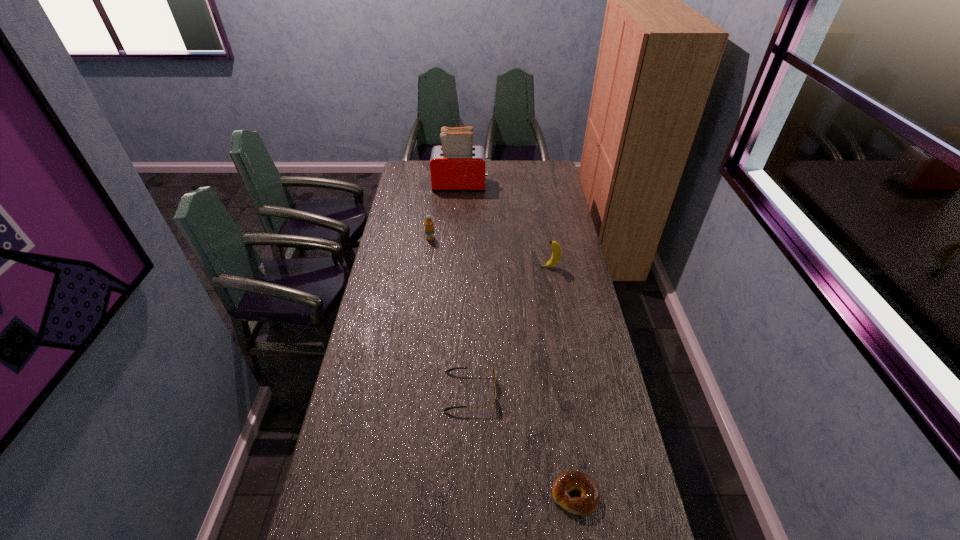
Locate an element on the screen. the farthest object is located at coordinates (456, 165).

What are the coordinates of `the tallest object` in the screenshot? It's located at (456, 165).

The height and width of the screenshot is (540, 960). What are the coordinates of `banana` in the screenshot? It's located at (556, 254).

This screenshot has width=960, height=540. What are the coordinates of `the third tallest object` in the screenshot? It's located at (429, 228).

At what (x,y) coordinates should I click in order to perform the action: click on orange juice. Please return your answer as a coordinate pair (x, y). Image resolution: width=960 pixels, height=540 pixels. Looking at the image, I should click on (429, 228).

The width and height of the screenshot is (960, 540). In order to click on the fourth farthest object in this screenshot , I will do `click(451, 369)`.

In order to click on the second shortest object in this screenshot , I will do `click(451, 369)`.

Identify the location of the nearest object. This screenshot has height=540, width=960. (569, 481).

This screenshot has height=540, width=960. In order to click on the shortest object in this screenshot , I will do `click(569, 481)`.

I want to click on vacant region located 0.160m on the front-facing side of the toaster, so click(519, 185).